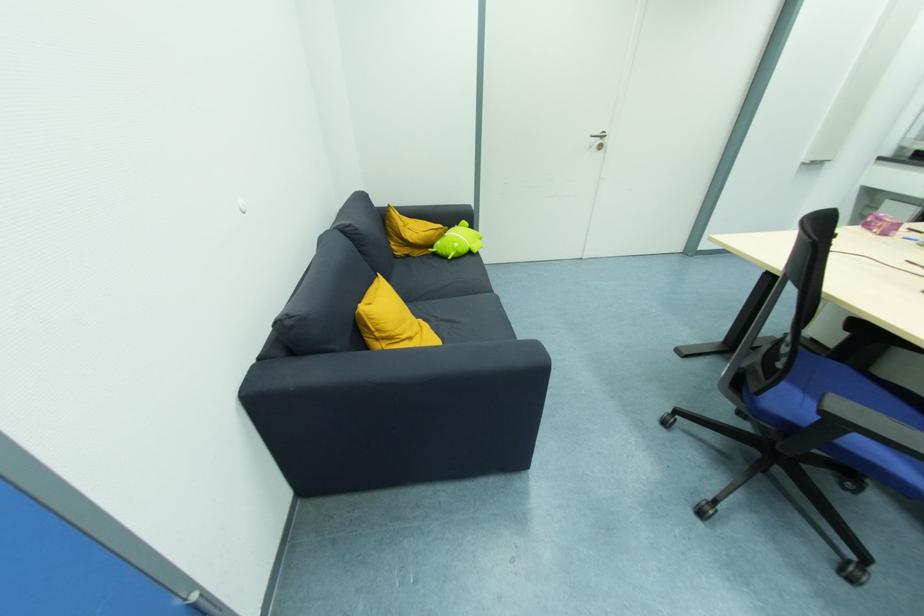
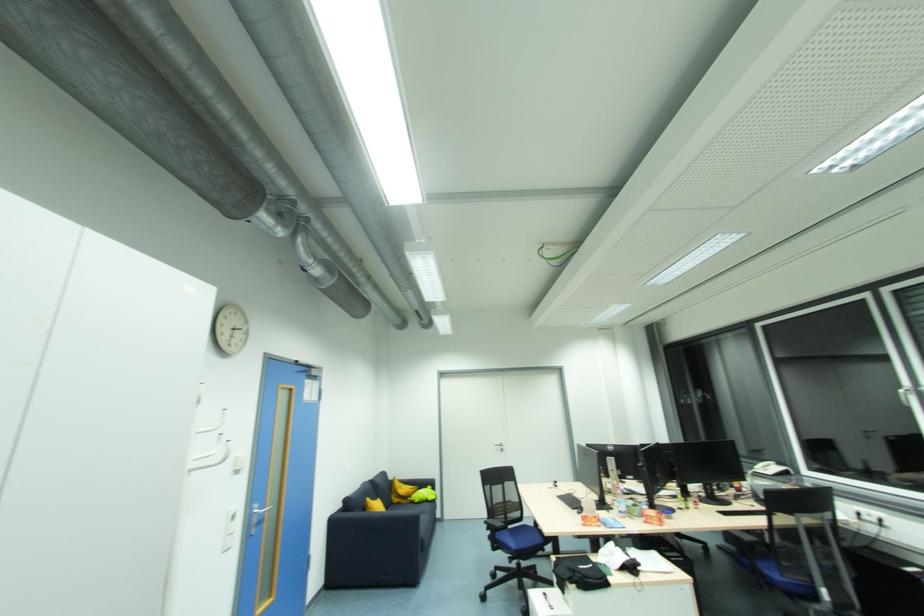
Locate, in the second image, the point that corresponds to (410,257) in the first image.

(400, 505)